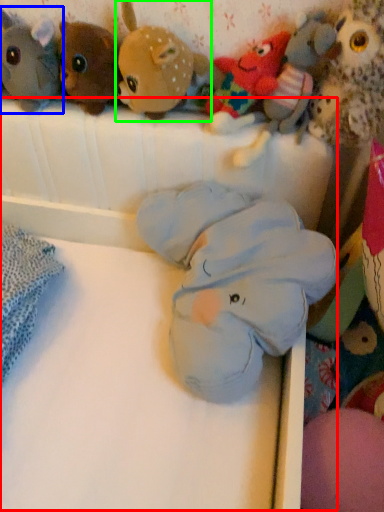
Question: Considering the real-world distances, which object is closest to infant bed (highlighted by a red box)? toy (highlighted by a blue box) or toy (highlighted by a green box).

Choices:
 (A) toy
 (B) toy

Answer: (B)